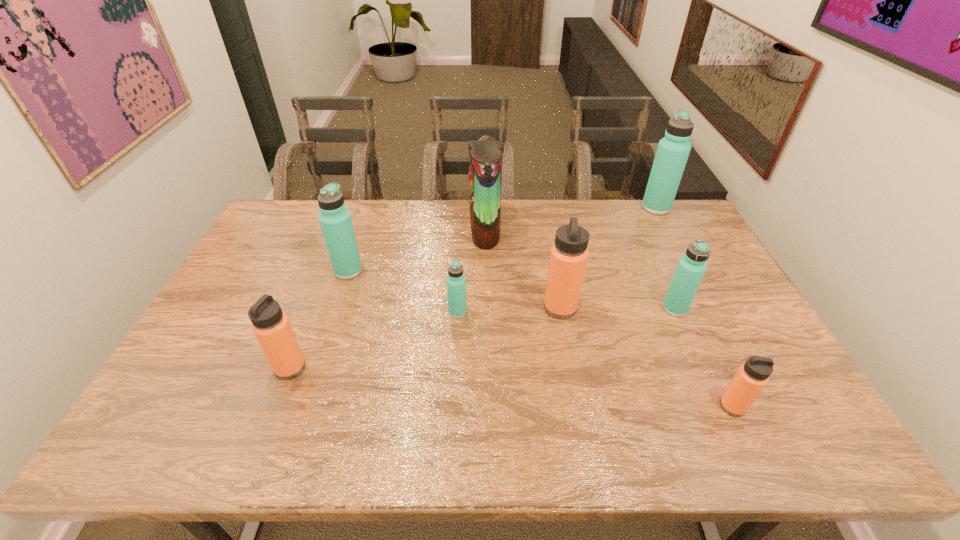
This screenshot has height=540, width=960. What are the coordinates of `vacant area that satisfies the following two spatial constraints: 1. on the front side of the nearest object; 2. on the left side of the second smallest orange thermos bottle` in the screenshot? It's located at (275, 407).

Image resolution: width=960 pixels, height=540 pixels. I want to click on free spot that satisfies the following two spatial constraints: 1. at the face of the parrot; 2. on the back side of the second aqua thermos bottle from right to left, so tap(486, 308).

You are a GUI agent. You are given a task and a screenshot of the screen. Output one action in this format:
    pyautogui.click(x=<x>, y=<y>)
    Task: Click on the vacant space that satisfies the following two spatial constraints: 1. on the front side of the nearest thermos bottle; 2. on the left side of the biggest orange thermos bottle
    Image resolution: width=960 pixels, height=540 pixels.
    Given the screenshot: What is the action you would take?
    pyautogui.click(x=579, y=407)